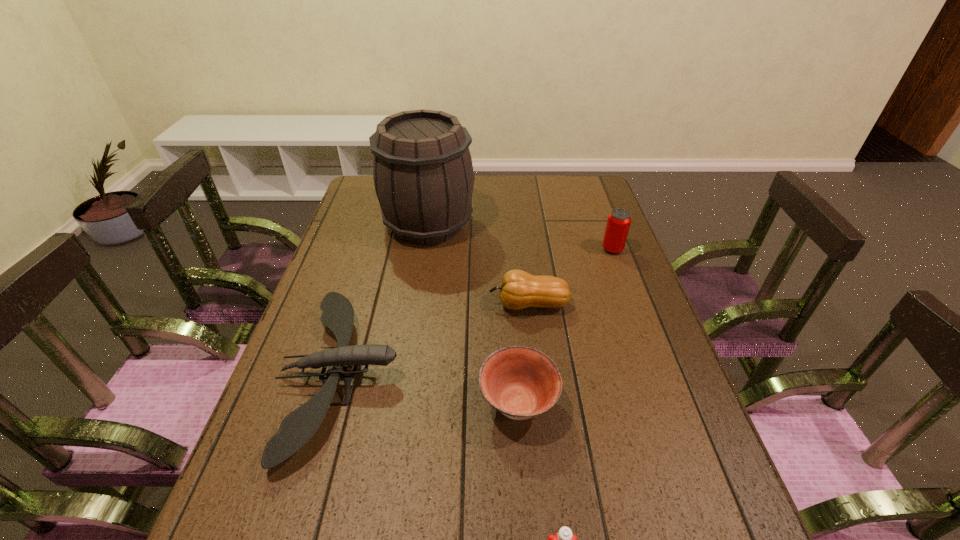
Locate an element on the screen. This screenshot has height=540, width=960. wine bucket is located at coordinates (423, 175).

Where is `the fifth shortest object`? The image size is (960, 540). the fifth shortest object is located at coordinates (619, 220).

This screenshot has width=960, height=540. What are the coordinates of `can` in the screenshot? It's located at [619, 220].

Locate an element on the screen. Image resolution: width=960 pixels, height=540 pixels. gourd is located at coordinates (518, 290).

Identify the location of bowl. This screenshot has height=540, width=960. (520, 382).

Find the location of a particular element. Image resolution: width=960 pixels, height=540 pixels. drone is located at coordinates (299, 426).

Locate an element on the screen. free spot located 0.300m on the right of the tallest object is located at coordinates pos(564,224).

Find the location of `vacant space located on the back of the can`. vacant space located on the back of the can is located at coordinates (590, 189).

At what (x,y) coordinates should I click in order to perform the action: click on free point located on the stem side of the gourd. Please return your answer as a coordinate pair (x, y). Looking at the image, I should click on (343, 305).

This screenshot has height=540, width=960. I want to click on free space located on the stem side of the gourd, so click(x=470, y=305).